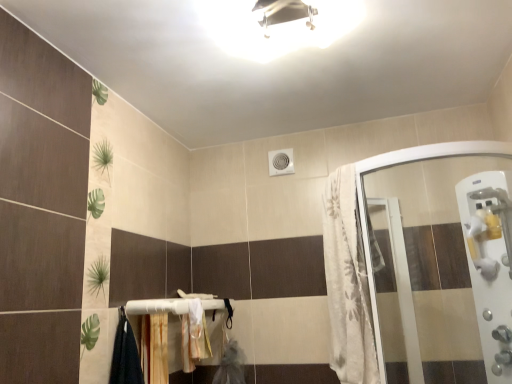
Question: Does wooden at lower center have a greater width compared to white textured fabric at right?

Choices:
 (A) yes
 (B) no

Answer: (B)

Question: Is wooden at lower center positioned beyond the bounds of white textured fabric at right?

Choices:
 (A) yes
 (B) no

Answer: (A)

Question: From the image's perspective, does wooden at lower center appear higher than white textured fabric at right?

Choices:
 (A) no
 (B) yes

Answer: (A)

Question: Is wooden at lower center to the left of white textured fabric at right from the viewer's perspective?

Choices:
 (A) yes
 (B) no

Answer: (A)

Question: Is white textured fabric at right surrounded by wooden at lower center?

Choices:
 (A) no
 (B) yes

Answer: (A)

Question: Does wooden at lower center have a lesser width compared to white textured fabric at right?

Choices:
 (A) yes
 (B) no

Answer: (A)

Question: Considering the relative sizes of white textured fabric at right and white glossy light fixture at upper center in the image provided, is white textured fabric at right smaller than white glossy light fixture at upper center?

Choices:
 (A) yes
 (B) no

Answer: (B)

Question: Can you confirm if white textured fabric at right is taller than white glossy light fixture at upper center?

Choices:
 (A) no
 (B) yes

Answer: (B)

Question: From the image's perspective, would you say white textured fabric at right is positioned over white glossy light fixture at upper center?

Choices:
 (A) yes
 (B) no

Answer: (B)

Question: Does white textured fabric at right come in front of white glossy light fixture at upper center?

Choices:
 (A) no
 (B) yes

Answer: (A)

Question: From a real-world perspective, is white textured fabric at right located beneath white glossy light fixture at upper center?

Choices:
 (A) yes
 (B) no

Answer: (A)

Question: Is white textured fabric at right oriented away from white glossy light fixture at upper center?

Choices:
 (A) yes
 (B) no

Answer: (B)

Question: Can you confirm if white fabric bath towel at lower center is smaller than white plastic handle at right?

Choices:
 (A) no
 (B) yes

Answer: (B)